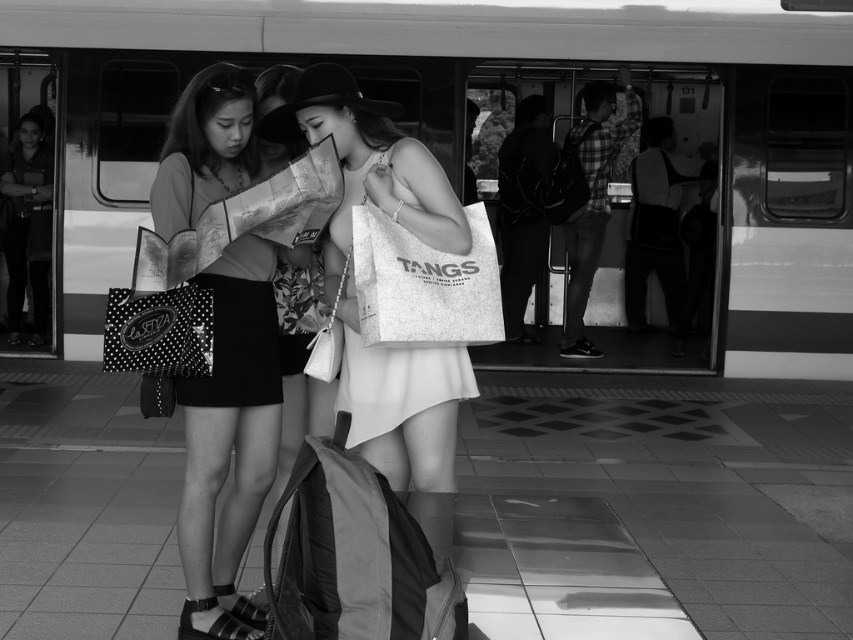
You are a photographer trying to capture a photo of the two women at the train station. You notice the leather backpack at center and the white paper bag at center. Which bag should you focus on to ensure it takes up more space in your photo?

The leather backpack at center has a greater width than the white paper bag at center, so focusing on it will ensure it takes up more space in your photo.

You are a traveler at the train station platform. You see the metallic silver train at center and the white paper bag at center. Which object is closer to you?

The metallic silver train at center is closer to you because it is positioned over the white paper bag at center, indicating it is in front.

You are helping a traveler who wants to pack their belongings into a small backpack. They have two bags to consider packing. The traveler mentions they need to fit the white paper bag at center and the polka dot fabric shopping bag at left. Which bag should they prioritize packing first to ensure both fit?

The traveler should prioritize packing the polka dot fabric shopping bag at left first since it is smaller in size compared to the white paper bag at center, allowing more room for the larger bag afterward.